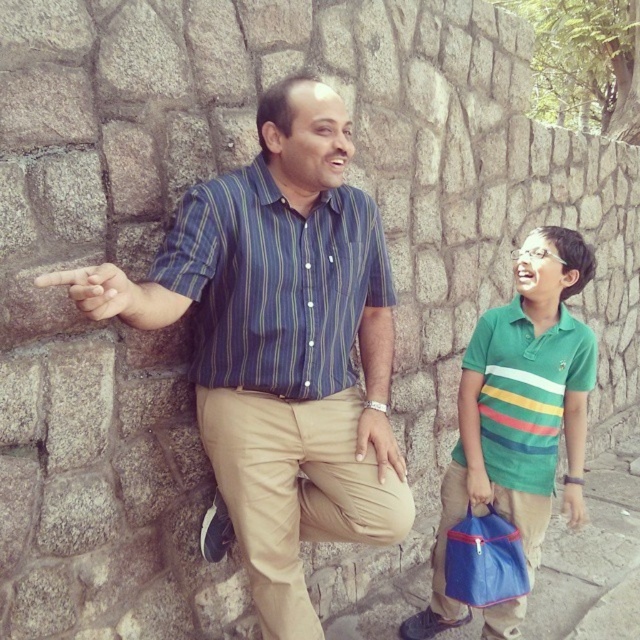
You are a photographer trying to capture both the blue striped shirt at center and the green striped polo shirt at right in a single frame. Which shirt should you focus on first to ensure both are in focus?

You should focus on the blue striped shirt at center first because it is closer to the viewer than the green striped polo shirt at right. By focusing on the closer object, the depth of field may allow the farther object to also be in focus.

Based on the photo, you are a fashion designer observing the two individuals in the image. You need to determine which of the two shirts, the blue striped shirt at center or the green striped polo shirt at right, would require more fabric to produce a similar design. Based on their sizes in the image, which one would need more material?

The blue striped shirt at center has a greater height compared to the green striped polo shirt at right, so it would require more fabric to produce a similar design.